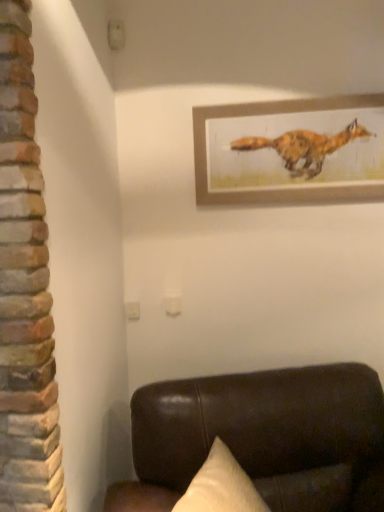
Question: Is wooden framed fox painting at upper center not within brown leather couch at lower right?

Choices:
 (A) yes
 (B) no

Answer: (A)

Question: From a real-world perspective, is wooden framed fox painting at upper center below brown leather couch at lower right?

Choices:
 (A) yes
 (B) no

Answer: (B)

Question: From the image's perspective, is wooden framed fox painting at upper center over brown leather couch at lower right?

Choices:
 (A) yes
 (B) no

Answer: (A)

Question: From a real-world perspective, does wooden framed fox painting at upper center stand above brown leather couch at lower right?

Choices:
 (A) no
 (B) yes

Answer: (B)

Question: Can you confirm if wooden framed fox painting at upper center is positioned to the left of brown leather couch at lower right?

Choices:
 (A) no
 (B) yes

Answer: (A)

Question: Considering the relative positions of wooden framed fox painting at upper center and brown leather couch at lower right in the image provided, is wooden framed fox painting at upper center behind brown leather couch at lower right?

Choices:
 (A) yes
 (B) no

Answer: (A)

Question: Is wooden framed fox painting at upper center surrounded by brown leather couch at lower right?

Choices:
 (A) no
 (B) yes

Answer: (A)

Question: Considering the relative sizes of brown leather couch at lower right and wooden framed fox painting at upper center in the image provided, is brown leather couch at lower right taller than wooden framed fox painting at upper center?

Choices:
 (A) no
 (B) yes

Answer: (B)

Question: Does brown leather couch at lower right come in front of wooden framed fox painting at upper center?

Choices:
 (A) yes
 (B) no

Answer: (A)

Question: Is brown leather couch at lower right looking in the opposite direction of wooden framed fox painting at upper center?

Choices:
 (A) no
 (B) yes

Answer: (A)

Question: Does brown leather couch at lower right have a greater width compared to wooden framed fox painting at upper center?

Choices:
 (A) yes
 (B) no

Answer: (A)

Question: From the image's perspective, is brown leather couch at lower right on top of wooden framed fox painting at upper center?

Choices:
 (A) yes
 (B) no

Answer: (B)

Question: Based on their positions, is wooden framed fox painting at upper center located to the left or right of brown leather couch at lower right?

Choices:
 (A) left
 (B) right

Answer: (B)